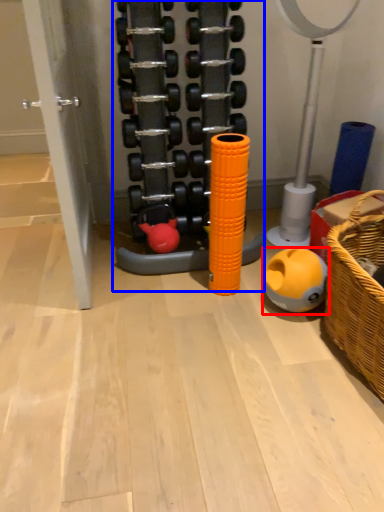
Question: Which of the following is the closest to the observer, toy (highlighted by a red box) or toy (highlighted by a blue box)?

Choices:
 (A) toy
 (B) toy

Answer: (B)